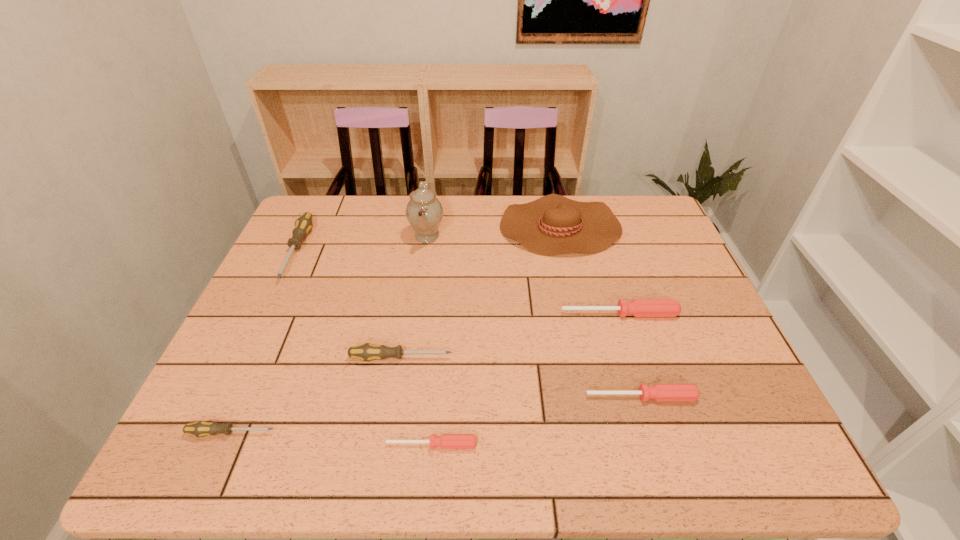
You are a GUI agent. You are given a task and a screenshot of the screen. Output one action in this format:
    pyautogui.click(x=<x>, y=<y>)
    Task: Click on the blank region between the smallest gray screwdriver and the chinaware
    This screenshot has width=960, height=540.
    Given the screenshot: What is the action you would take?
    pyautogui.click(x=329, y=335)

The image size is (960, 540). I want to click on vacant space that is in between the chinaware and the smallest gray screwdriver, so click(x=329, y=335).

Identify the location of vacant space in between the cowboy hat and the second nearest red screwdriver. (601, 312).

Find the location of `object that is the fourth closest to the farthest red screwdriver`. object that is the fourth closest to the farthest red screwdriver is located at coordinates (424, 212).

Locate an element on the screen. This screenshot has height=540, width=960. object identified as the fourth closest to the second nearest red screwdriver is located at coordinates (553, 224).

Find the location of `screwdriver identified as the closest to the farthest red screwdriver`. screwdriver identified as the closest to the farthest red screwdriver is located at coordinates (659, 392).

Locate an element on the screen. Image resolution: width=960 pixels, height=540 pixels. screwdriver that is the third closest one to the shortest object is located at coordinates (659, 392).

Where is `gray screwdriver identified as the closest to the smallest gray screwdriver`? The image size is (960, 540). gray screwdriver identified as the closest to the smallest gray screwdriver is located at coordinates (366, 352).

Select which gray screwdriver appears as the second closest to the smallest gray screwdriver. Please provide its 2D coordinates. Your answer should be formatted as a tuple, i.e. [(x, y)], where the tuple contains the x and y coordinates of a point satisfying the conditions above.

[(303, 225)]

Where is `red screwdriver that stands as the second closest to the fourth farthest object`? The width and height of the screenshot is (960, 540). red screwdriver that stands as the second closest to the fourth farthest object is located at coordinates (446, 441).